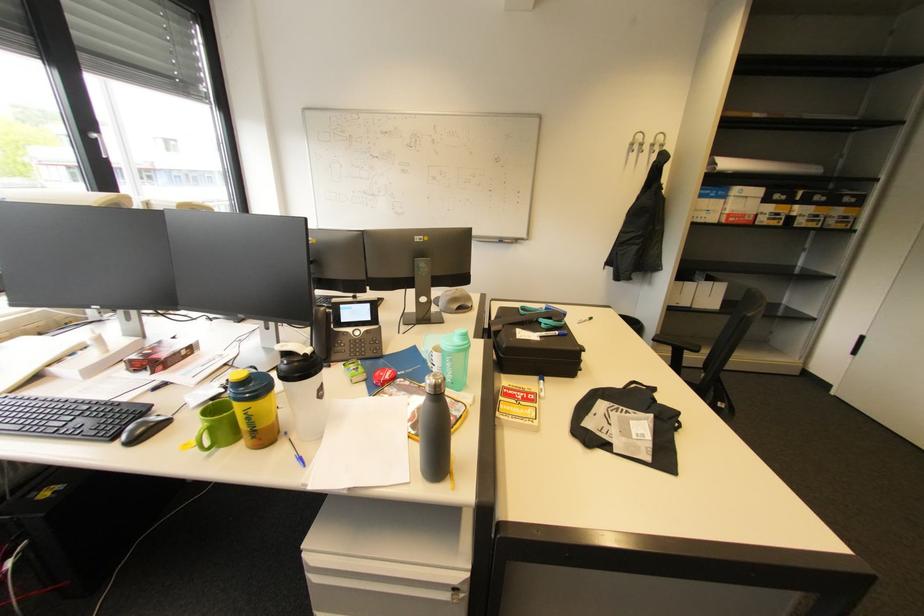
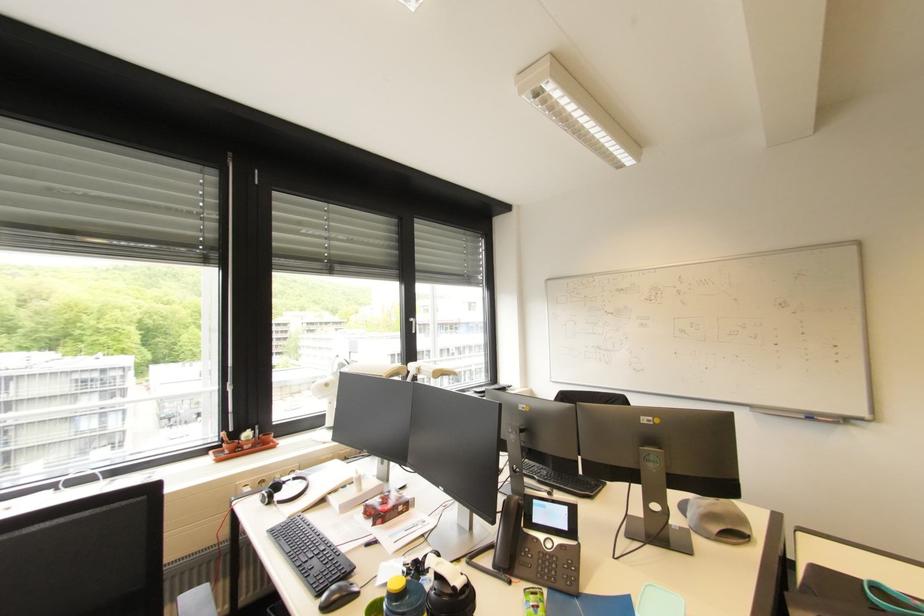
Where in the second image is the point corresponding to pixel 503 241 from the first image?

(808, 418)